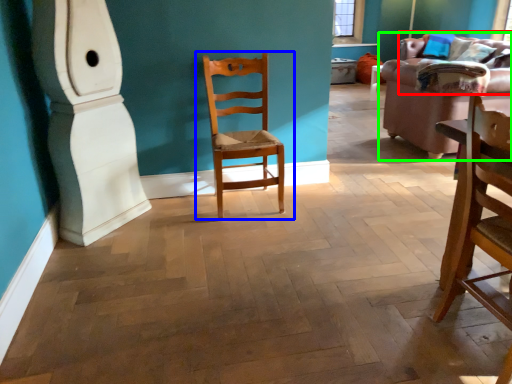
Question: Which object is positioned closest to couch (highlighted by a red box)? Select from chair (highlighted by a blue box) and studio couch (highlighted by a green box).

Choices:
 (A) chair
 (B) studio couch

Answer: (B)